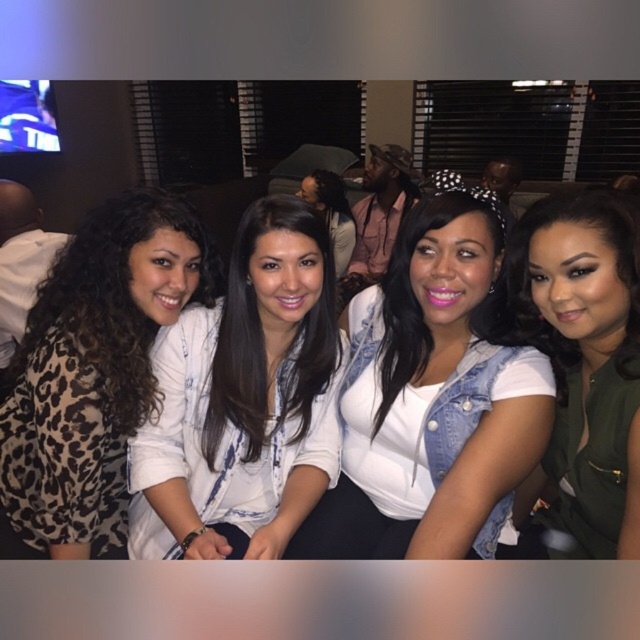
Question: Among these objects, which one is nearest to the camera?

Choices:
 (A) white printed shirt at center
 (B) leopard print top at left
 (C) denim jacket at center
 (D) green matte vest at center

Answer: (C)

Question: Which of the following is the farthest from the observer?

Choices:
 (A) (518, 452)
 (B) (97, 278)
 (C) (570, 392)
 (D) (179, 317)

Answer: (D)

Question: Can you confirm if white printed shirt at center is bigger than green matte vest at center?

Choices:
 (A) no
 (B) yes

Answer: (B)

Question: Can you confirm if leopard print top at left is positioned above green matte vest at center?

Choices:
 (A) yes
 (B) no

Answer: (A)

Question: Is white printed shirt at center positioned in front of green matte vest at center?

Choices:
 (A) no
 (B) yes

Answer: (A)

Question: Which of the following is the closest to the observer?

Choices:
 (A) denim jacket at center
 (B) leopard print top at left
 (C) green matte vest at center
 (D) white printed shirt at center

Answer: (A)